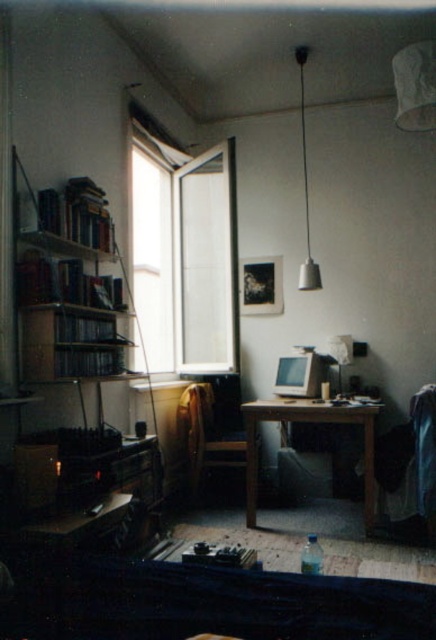
You are moving a 7.5 feet long ladder through the room. The ladder must be carried horizontally. You need to pass between the wooden bookshelf at left and the metallic silver lampshade at upper center. Is the distance between them sufficient to allow the ladder to pass through without tilting or rotating it?

The wooden bookshelf at left is 8.23 feet from the metallic silver lampshade at upper center. Since the ladder is 7.5 feet long and the distance between the objects is 8.23 feet, there is enough space for the ladder to pass horizontally without tilting or rotating it.

You are organizing a study area and need to place a tall plant between the wooden bookshelf at left and the wooden table at center. Based on their positions, where should the plant be placed to ensure it doesn

The wooden bookshelf at left is located above the wooden table at center. Therefore, to place the plant between them, it should be positioned below the wooden bookshelf at left and above the wooden table at center.